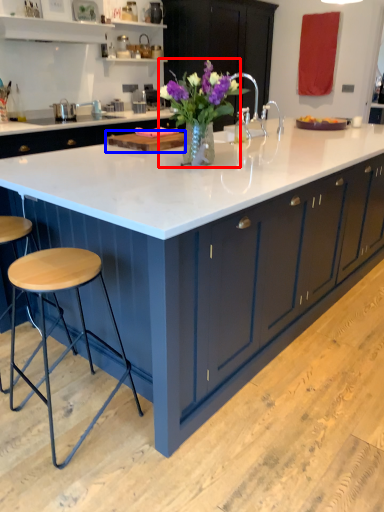
Question: Among these objects, which one is farthest to the camera, floral arrangement (highlighted by a red box) or wood (highlighted by a blue box)?

Choices:
 (A) floral arrangement
 (B) wood

Answer: (B)